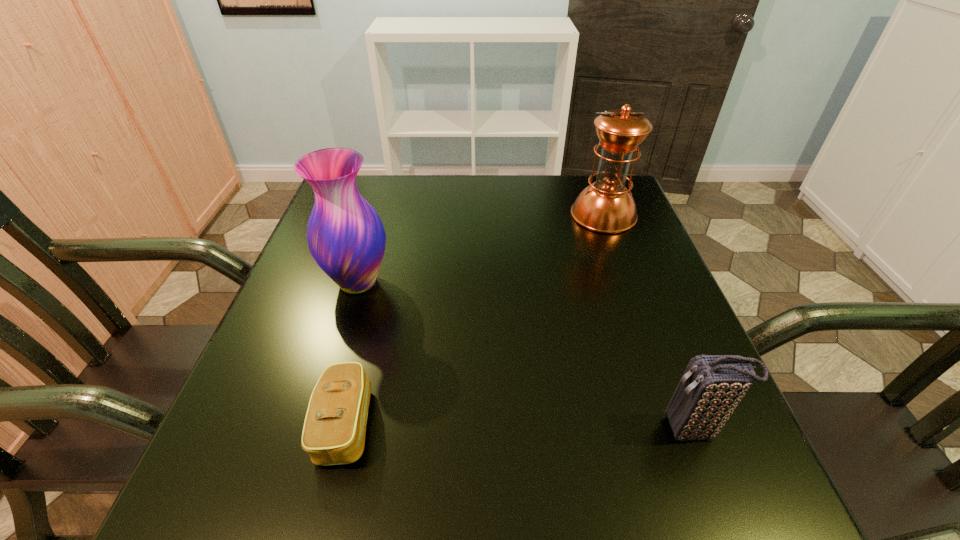
This screenshot has height=540, width=960. Find the location of `vacant space located 0.190m with the zip open on the taller clutch bag`. vacant space located 0.190m with the zip open on the taller clutch bag is located at coordinates (540, 429).

Locate an element on the screen. This screenshot has width=960, height=540. free region located 0.050m on the zipper side of the shortest object is located at coordinates (404, 423).

Identify the location of object positioned at the far edge. This screenshot has height=540, width=960. (606, 206).

Find the location of a particular element. object at the near edge is located at coordinates (334, 430).

The image size is (960, 540). In order to click on vase that is at the left edge in this screenshot , I will do `click(346, 237)`.

You are a GUI agent. You are given a task and a screenshot of the screen. Output one action in this format:
    pyautogui.click(x=<x>, y=<y>)
    Task: Click on the clutch bag located at the left edge
    This screenshot has height=540, width=960.
    Given the screenshot: What is the action you would take?
    pyautogui.click(x=334, y=430)

At what (x,y) coordinates should I click in order to perform the action: click on oil lamp at the right edge. Please return your answer as a coordinate pair (x, y). Image resolution: width=960 pixels, height=540 pixels. Looking at the image, I should click on (606, 206).

Locate an element on the screen. This screenshot has width=960, height=540. clutch bag located in the right edge section of the desktop is located at coordinates (711, 387).

At what (x,y) coordinates should I click in order to perform the action: click on object present at the near left corner. Please return your answer as a coordinate pair (x, y). The image size is (960, 540). Looking at the image, I should click on (334, 430).

Find the location of `object at the far right corner`. object at the far right corner is located at coordinates [606, 206].